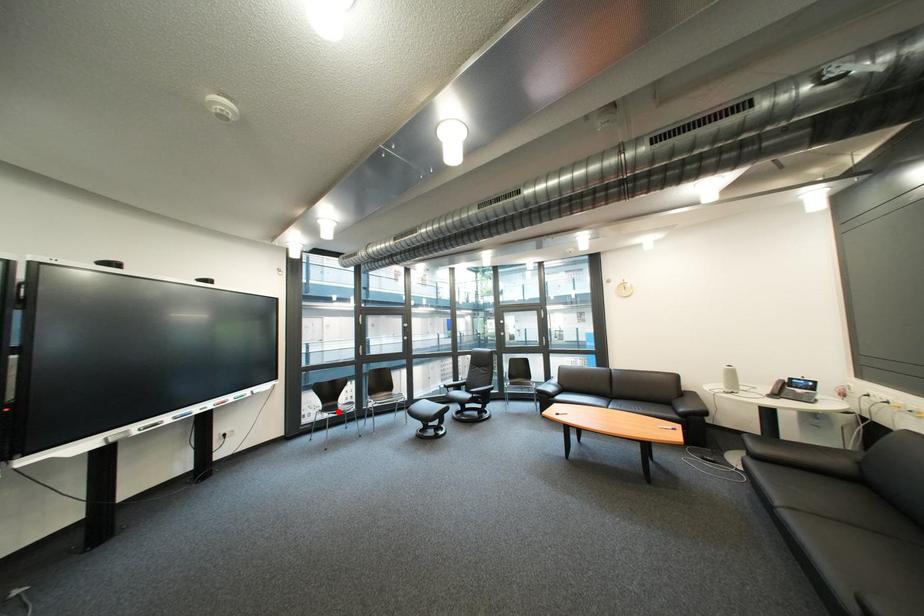
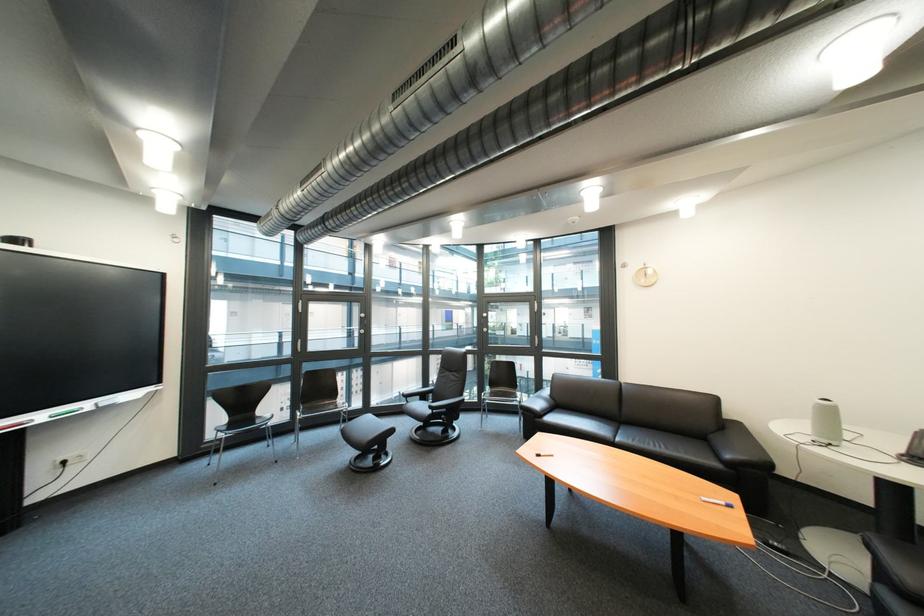
Question: A red point is marked in image1. In image2, is the corresponding 3D point closer to the camera or farther? Reply with the corresponding letter.

Choices:
 (A) The corresponding 3D point is closer.
 (B) The corresponding 3D point is farther.

Answer: (A)